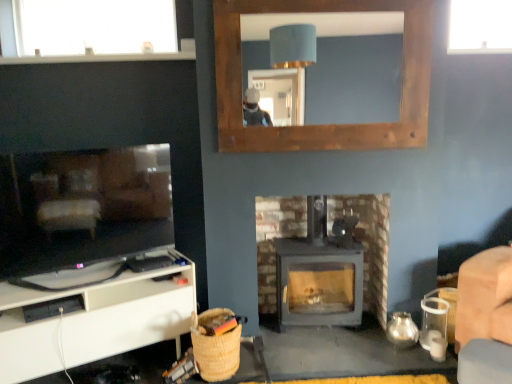
I want to click on free point below wooden frame mirror at upper center (from a real-world perspective), so click(x=329, y=341).